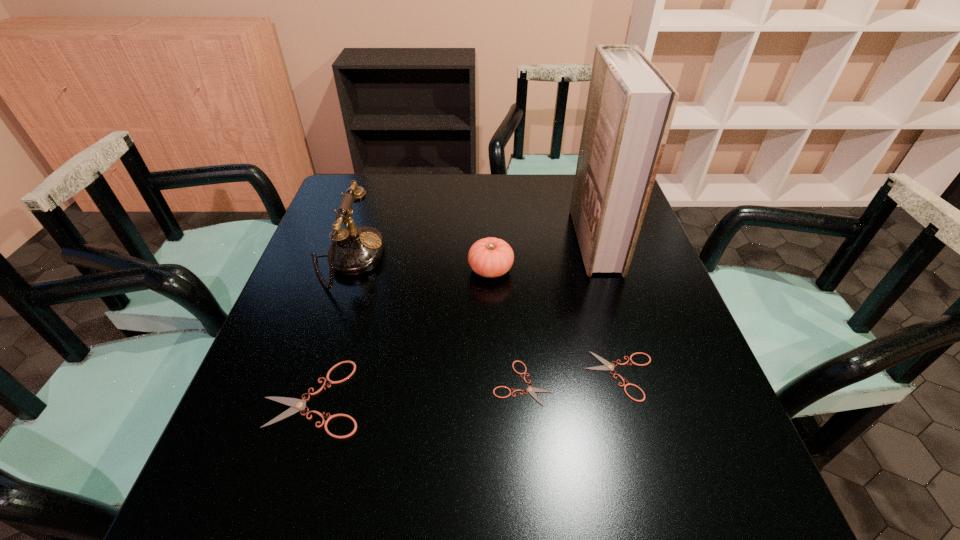
This screenshot has height=540, width=960. I want to click on the third shortest object, so point(297,405).

Where is `the leftmost shears`? the leftmost shears is located at coordinates (297, 405).

Find the location of a particular element. Image resolution: width=960 pixels, height=540 pixels. the shortest object is located at coordinates point(530,389).

Locate an element on the screen. This screenshot has width=960, height=540. the second shears from right to left is located at coordinates (530, 389).

Locate an element on the screen. the second shortest shears is located at coordinates (607, 365).

Locate an element on the screen. Image resolution: width=960 pixels, height=540 pixels. the rightmost shears is located at coordinates (607, 365).

Identify the location of phonebook. (630, 107).

Where is `tomato`? tomato is located at coordinates (490, 257).

The width and height of the screenshot is (960, 540). Find the location of `telephone`. telephone is located at coordinates (356, 250).

Locate an element on the screen. vacant space located 0.200m on the back of the leftmost shears is located at coordinates (347, 294).